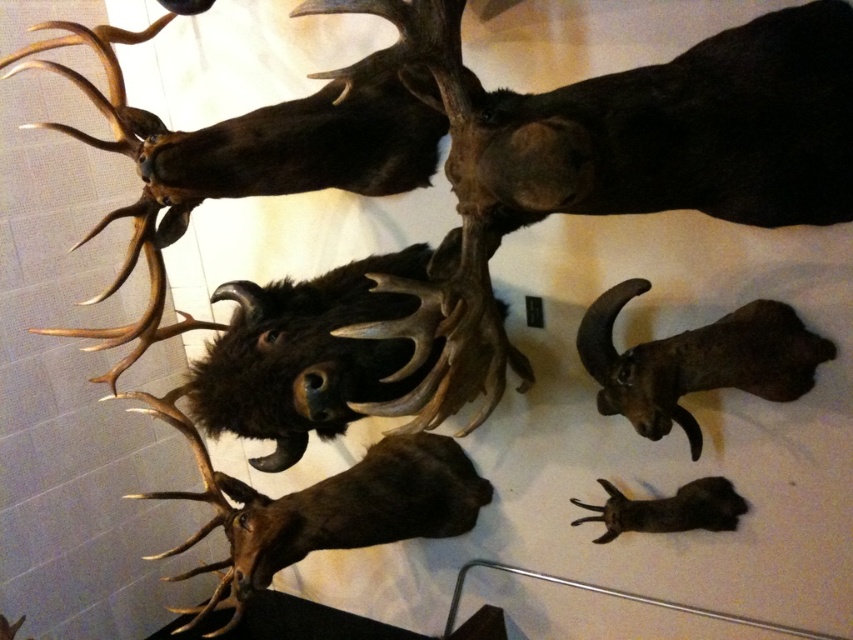
You are an art curator planning to rearrange the display. If you want to place a new plaque below the brown furry animal at center, where should you position it in relation to the brown matte skull at lower right?

The brown furry animal at center is located above the brown matte skull at lower right, so the plaque should be placed below the brown furry animal at center, which would be above the brown matte skull at lower right.

You are standing in front of the taxidermied animal heads display. There are two points marked on the wall where new mounts could be placed. The first point is at coordinates point (236, 536) and the second is at point (752, 320). Which of these two points is closer to you?

Point (236, 536) is closer to you because it is further to the viewer than point (752, 320).